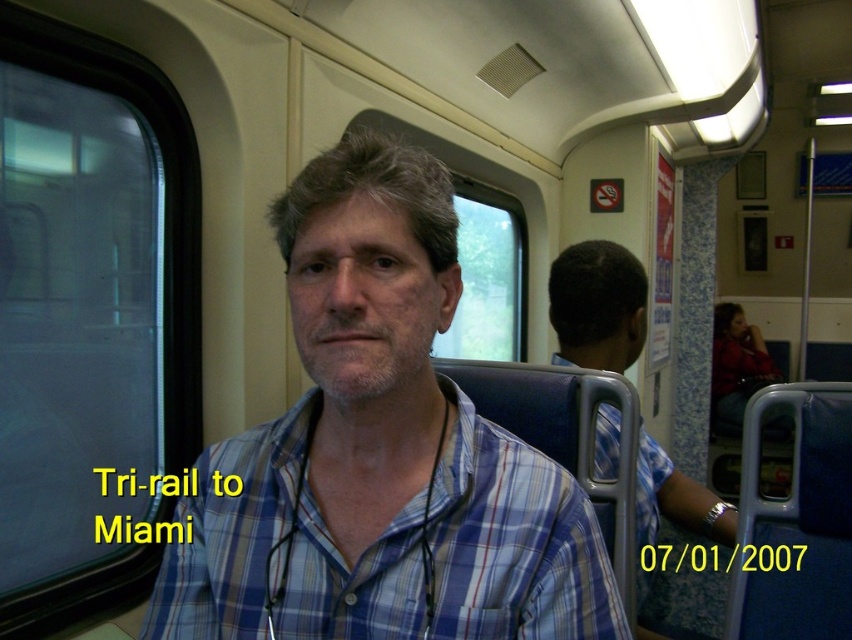
Is blue plaid shirt at center taller than blue plaid shirt at right?

Incorrect, blue plaid shirt at center's height is not larger of blue plaid shirt at right's.

Is the position of blue plaid shirt at center more distant than that of blue plaid shirt at right?

No, blue plaid shirt at center is closer to the viewer.

Identify the location of blue plaid shirt at center. (380, 452).

The image size is (852, 640). Find the location of `blue plaid shirt at center`. blue plaid shirt at center is located at coordinates (380, 452).